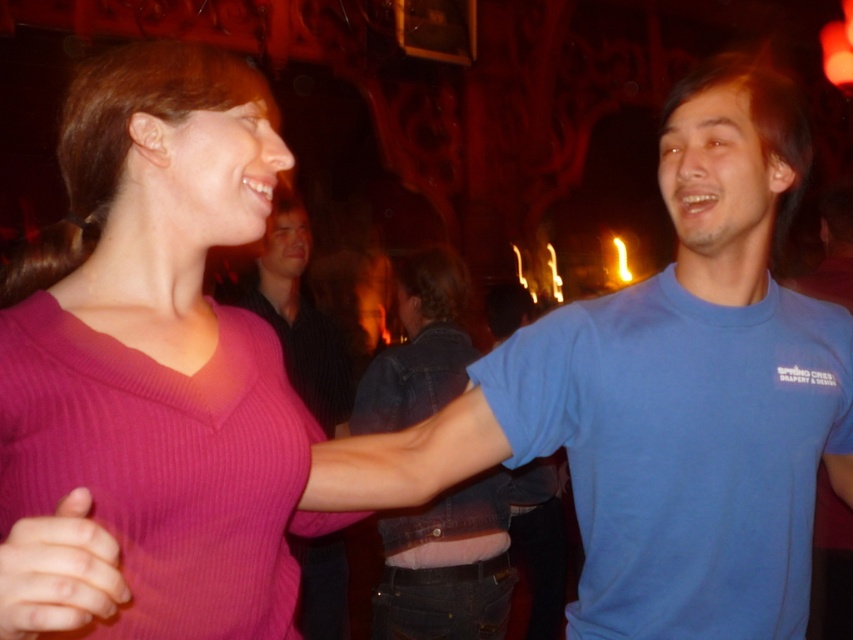
You are at a party and want to approach the person wearing the pink ribbed sweater at center. However, there is another pink ribbed sweater at lower left in your way. Which sweater should you avoid stepping over to reach the person?

You should avoid stepping over the pink ribbed sweater at lower left since the pink ribbed sweater at center is closer to you, meaning the one at lower left is farther away and blocking your path.